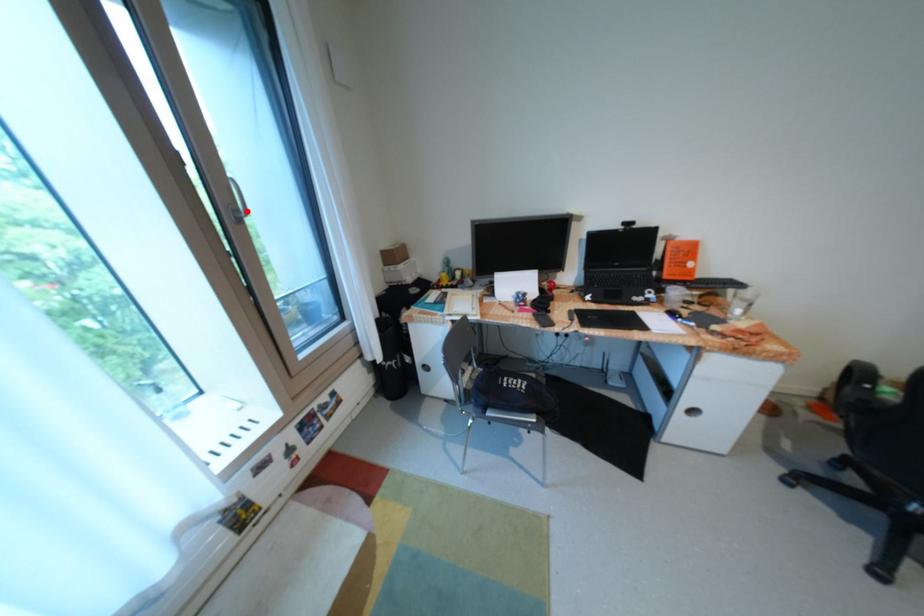
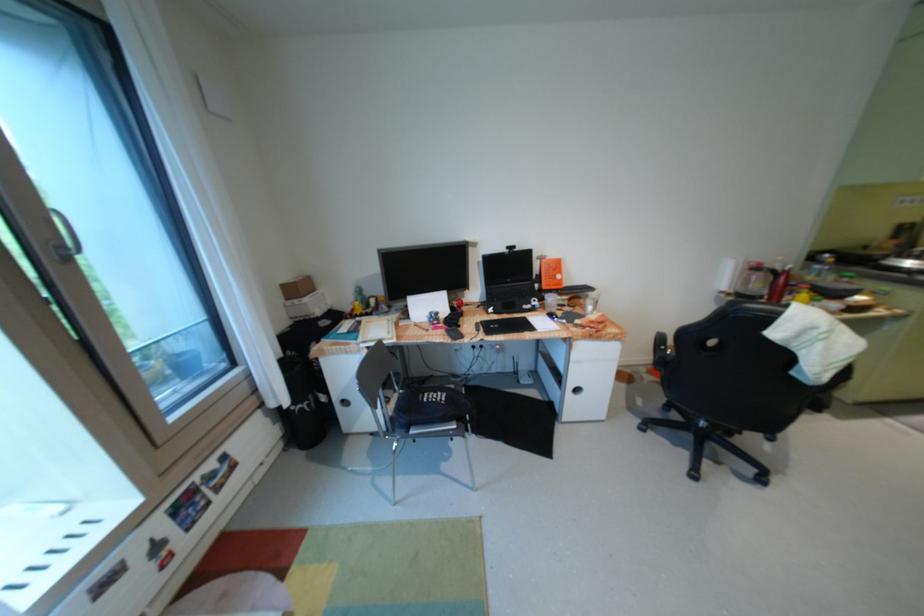
Question: I am providing you with two images of the same scene from different viewpoints. Image1 has a red point marked. In image2, the corresponding 3D location appears at what relative position? Reply with the corresponding letter.

Choices:
 (A) Closer
 (B) Farther

Answer: (B)